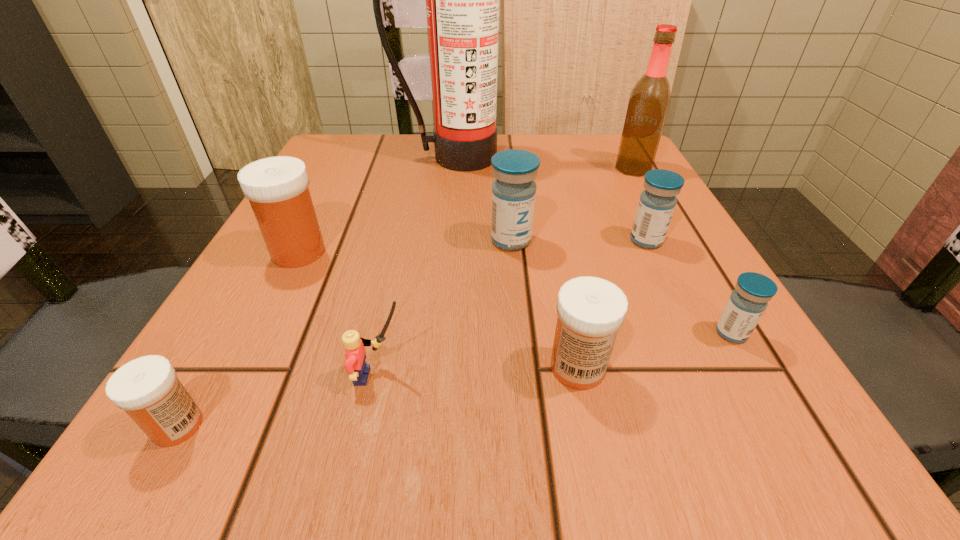
Where is `vacant region located 0.330m on the front-facing side of the yellow Lego`? This screenshot has width=960, height=540. vacant region located 0.330m on the front-facing side of the yellow Lego is located at coordinates (671, 376).

The width and height of the screenshot is (960, 540). Find the location of `blank space located 0.330m on the left of the rightmost blue medicine`. blank space located 0.330m on the left of the rightmost blue medicine is located at coordinates (472, 333).

What are the coordinates of `blank space located 0.370m on the right of the nearest object` in the screenshot? It's located at (532, 426).

What are the coordinates of `fire extinguisher at the far edge` in the screenshot? It's located at (462, 0).

Identify the location of beer bottle that is positioned at the far edge. tap(650, 98).

Where is `object present at the near edge`? This screenshot has height=540, width=960. object present at the near edge is located at coordinates (147, 388).

The height and width of the screenshot is (540, 960). What are the coordinates of `beer bottle that is at the right edge` in the screenshot? It's located at (650, 98).

Where is `object that is at the near left corner`? This screenshot has width=960, height=540. object that is at the near left corner is located at coordinates (147, 388).

You are a GUI agent. You are given a task and a screenshot of the screen. Output one action in this format:
    pyautogui.click(x=<x>, y=<y>)
    Task: Click on the object located in the far right corner section of the desktop
    This screenshot has width=960, height=540.
    Given the screenshot: What is the action you would take?
    pyautogui.click(x=650, y=98)

Locate an element on the screen. vacant region at the far edge is located at coordinates (508, 133).